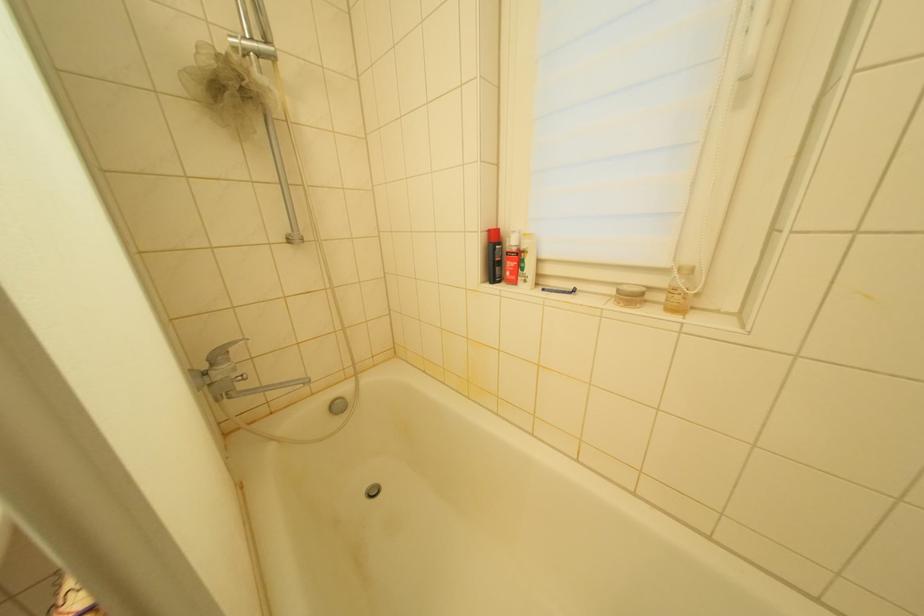
Locate an element on the screen. silver shower head is located at coordinates (253, 31).